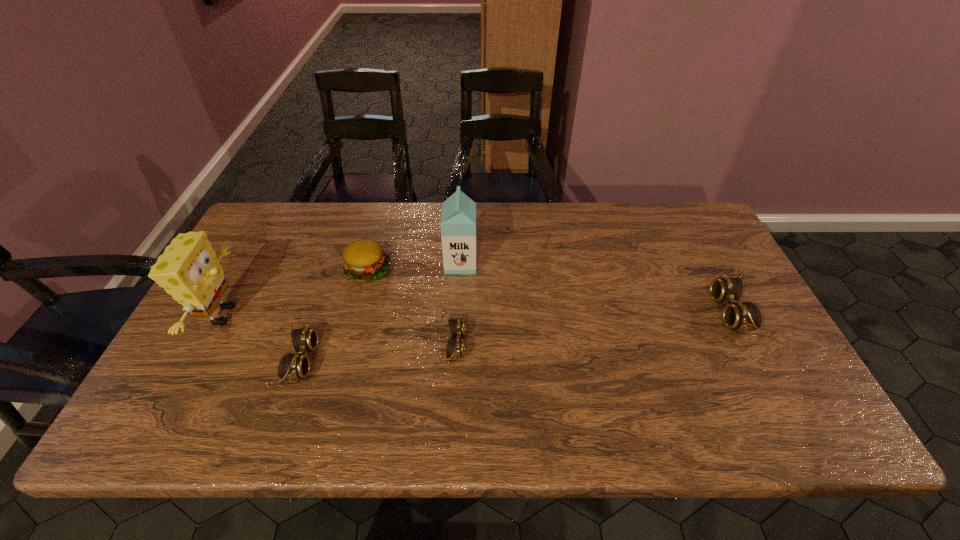
In the image, there is a desktop. Where is `vacant space at the near edge`? The width and height of the screenshot is (960, 540). vacant space at the near edge is located at coordinates (710, 386).

This screenshot has width=960, height=540. I want to click on free location at the left edge, so click(262, 256).

Where is `vacant space at the right edge`? vacant space at the right edge is located at coordinates (724, 340).

You are a GUI agent. You are given a task and a screenshot of the screen. Output one action in this format:
    pyautogui.click(x=<x>, y=<y>)
    Task: Click on the vacant space at the far left corner
    This screenshot has width=960, height=540.
    Given the screenshot: What is the action you would take?
    pyautogui.click(x=286, y=244)

Identify the location of free space at the far right corner of the desktop. (684, 204).

Where is `vacant region between the rightmost goggles and the fifth tallest object`? The width and height of the screenshot is (960, 540). vacant region between the rightmost goggles and the fifth tallest object is located at coordinates (516, 338).

Identify the location of empty space between the fourth object from right to left and the fifth object from right to left. [x=333, y=316].

The image size is (960, 540). Identify the location of blank region between the shortest goggles and the third object from left to right. (410, 308).

The height and width of the screenshot is (540, 960). I want to click on vacant point located between the milk carton and the third object from left to right, so click(414, 267).

Locate an element on the screen. The image size is (960, 540). free space between the third object from left to right and the fifth tallest object is located at coordinates (333, 316).